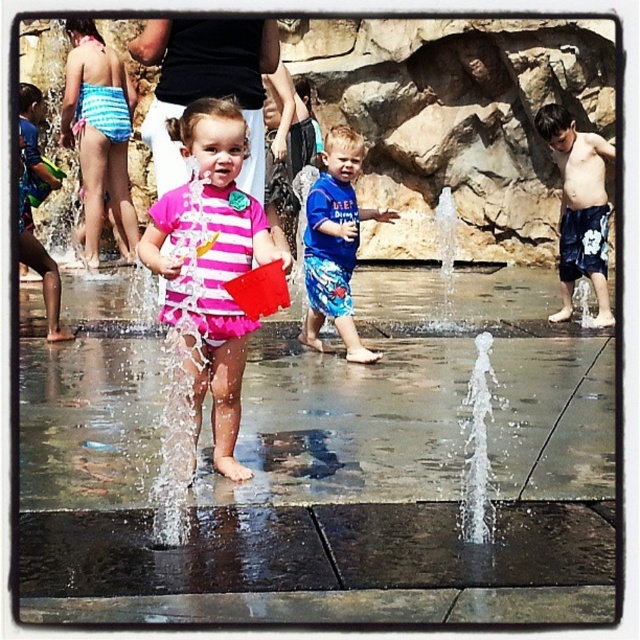
Question: Which point appears farthest from the camera in this image?

Choices:
 (A) (88, 192)
 (B) (321, 189)

Answer: (A)

Question: Which point appears closest to the camera in this image?

Choices:
 (A) (164, 385)
 (B) (230, 474)

Answer: (B)

Question: Is the position of pink fabric splash at center more distant than that of blue printed shorts at center?

Choices:
 (A) no
 (B) yes

Answer: (A)

Question: Is pink matte swimsuit at center to the left of blue printed shorts at center from the viewer's perspective?

Choices:
 (A) yes
 (B) no

Answer: (A)

Question: Is the position of pink fabric splash at center less distant than that of blue striped swimsuit at upper left?

Choices:
 (A) yes
 (B) no

Answer: (A)

Question: Based on their relative distances, which object is farther from the blue striped swimsuit at upper left?

Choices:
 (A) pink matte swimsuit at center
 (B) blue printed shorts at center
 (C) pink fabric splash at center

Answer: (A)